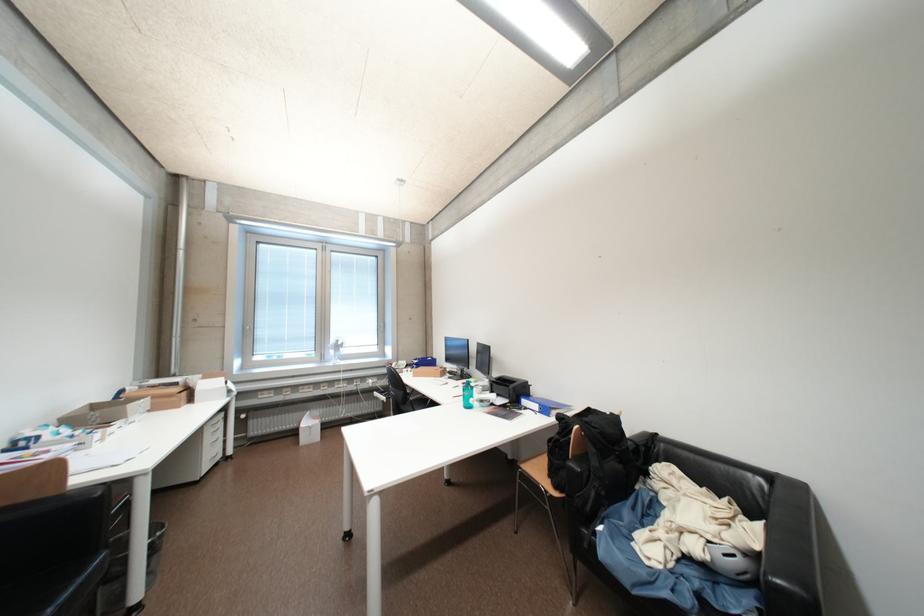
Where would you sit the sofa sitting surface? Please return your answer as a coordinate pair (x, y).

(667, 544)